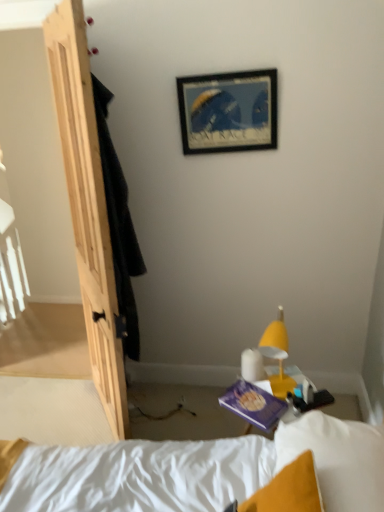
Locate an element on the screen. This screenshot has height=512, width=384. blank space situated above purple matte paperback book at lower center (from a real-world perspective) is located at coordinates (257, 397).